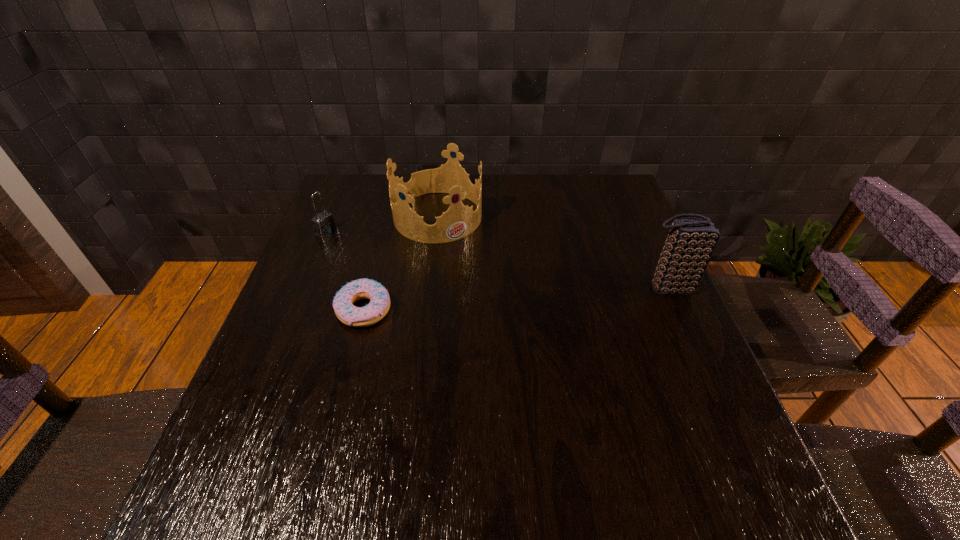
Locate an element on the screen. The width and height of the screenshot is (960, 540). free space on the desktop that is between the doughnut and the clutch bag and is positioned on the shackle of the third tallest object is located at coordinates (480, 301).

Find the location of a particular element. The height and width of the screenshot is (540, 960). vacant space on the desktop that is between the shortest object and the clutch bag and is positioned on the front-facing side of the third shortest object is located at coordinates (511, 299).